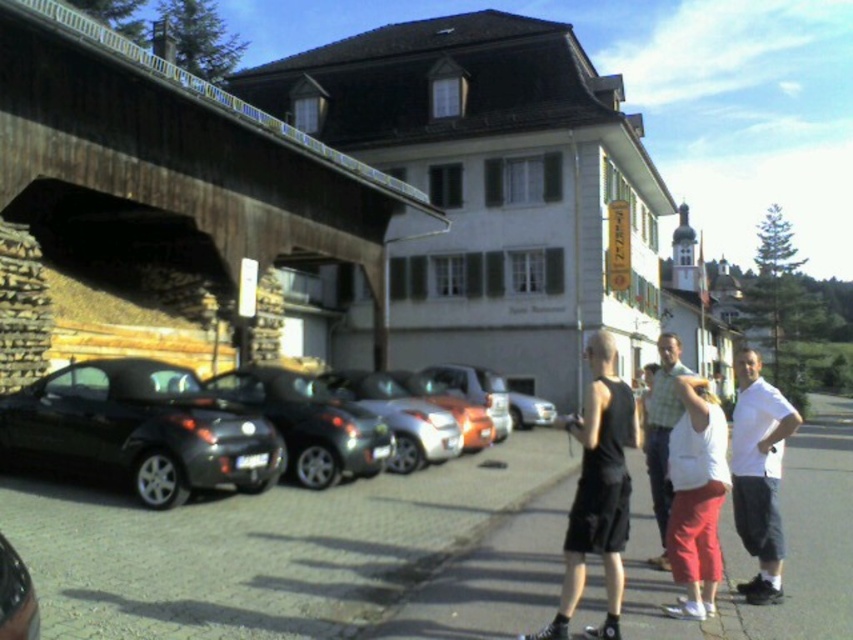
Question: Among these points, which one is nearest to the camera?

Choices:
 (A) (657, 404)
 (B) (737, 433)

Answer: (B)

Question: Which object is the closest to the white shirt at center?

Choices:
 (A) shiny black car at center
 (B) wooden bridge at upper left
 (C) shiny black convertible at center

Answer: (A)

Question: Estimate the real-world distances between objects in this image. Which object is closer to the white cotton shirt at right?

Choices:
 (A) smooth concrete sidewalk at center
 (B) shiny black car at center
 (C) black matte skateboard at center

Answer: (A)

Question: Observing the image, what is the correct spatial positioning of smooth concrete sidewalk at center in reference to white cotton shirt at right?

Choices:
 (A) left
 (B) right

Answer: (B)

Question: Does smooth concrete sidewalk at center have a smaller size compared to black matte skateboard at center?

Choices:
 (A) no
 (B) yes

Answer: (B)

Question: Does black matte skateboard at center lie in front of white shirt at center?

Choices:
 (A) yes
 (B) no

Answer: (A)